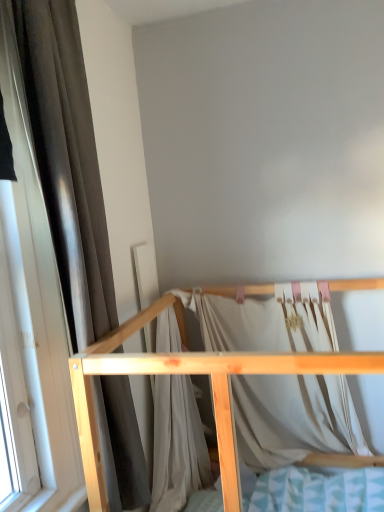
This screenshot has width=384, height=512. What are the coordinates of `brown fabric curtain at left` in the screenshot? It's located at (66, 160).

Describe the element at coordinates (66, 160) in the screenshot. Image resolution: width=384 pixels, height=512 pixels. I see `brown fabric curtain at left` at that location.

What do you see at coordinates (186, 373) in the screenshot? I see `natural wood bed frame at center` at bounding box center [186, 373].

What are the coordinates of `natural wood bed frame at center` in the screenshot? It's located at (186, 373).

The width and height of the screenshot is (384, 512). I want to click on brown fabric curtain at left, so click(x=66, y=160).

Which is more to the right, natural wood bed frame at center or brown fabric curtain at left?

natural wood bed frame at center.

Does natural wood bed frame at center lie in front of brown fabric curtain at left?

That is True.

Does point (163, 356) lie behind point (113, 305)?

No, it is in front of (113, 305).

From the image's perspective, which is above, natural wood bed frame at center or brown fabric curtain at left?

From the image's view, brown fabric curtain at left is above.

Looking at this image, from a real-world perspective, does natural wood bed frame at center sit lower than brown fabric curtain at left?

Yes, from a real-world perspective, natural wood bed frame at center is beneath brown fabric curtain at left.

Considering the sizes of objects natural wood bed frame at center and brown fabric curtain at left in the image provided, who is thinner, natural wood bed frame at center or brown fabric curtain at left?

brown fabric curtain at left.

Considering the relative sizes of natural wood bed frame at center and brown fabric curtain at left in the image provided, is natural wood bed frame at center shorter than brown fabric curtain at left?

Indeed, natural wood bed frame at center has a lesser height compared to brown fabric curtain at left.

Is natural wood bed frame at center bigger or smaller than brown fabric curtain at left?

natural wood bed frame at center is bigger than brown fabric curtain at left.

Is natural wood bed frame at center not within brown fabric curtain at left?

Yes, natural wood bed frame at center is located beyond the bounds of brown fabric curtain at left.

Are natural wood bed frame at center and brown fabric curtain at left far apart?

No, natural wood bed frame at center is not far away from brown fabric curtain at left.

Could you tell me if natural wood bed frame at center is facing brown fabric curtain at left?

No.

I want to click on curtain located above the natural wood bed frame at center (from the image's perspective), so click(66, 160).

Can you confirm if brown fabric curtain at left is positioned to the right of natural wood bed frame at center?

In fact, brown fabric curtain at left is to the left of natural wood bed frame at center.

Who is more distant, brown fabric curtain at left or natural wood bed frame at center?

brown fabric curtain at left is behind.

Which is in front, point (46, 133) or point (380, 464)?

Point (46, 133)

From the image's perspective, is brown fabric curtain at left located above or below natural wood bed frame at center?

Based on their image positions, brown fabric curtain at left is located above natural wood bed frame at center.

From a real-world perspective, is brown fabric curtain at left physically located above or below natural wood bed frame at center?

From a real-world perspective, brown fabric curtain at left is physically above natural wood bed frame at center.

Considering the sizes of objects brown fabric curtain at left and natural wood bed frame at center in the image provided, who is wider, brown fabric curtain at left or natural wood bed frame at center?

With larger width is natural wood bed frame at center.

Considering the sizes of objects brown fabric curtain at left and natural wood bed frame at center in the image provided, who is shorter, brown fabric curtain at left or natural wood bed frame at center?

With less height is natural wood bed frame at center.

Does brown fabric curtain at left have a smaller size compared to natural wood bed frame at center?

Yes.

Would you say natural wood bed frame at center is part of brown fabric curtain at left's contents?

No, natural wood bed frame at center is not inside brown fabric curtain at left.

Are brown fabric curtain at left and natural wood bed frame at center located far from each other?

That's not correct — brown fabric curtain at left is a little close to natural wood bed frame at center.

Is brown fabric curtain at left positioned with its back to natural wood bed frame at center?

No, brown fabric curtain at left's orientation is not away from natural wood bed frame at center.

What's the angular difference between brown fabric curtain at left and natural wood bed frame at center's facing directions?

87.8 degrees separate the facing orientations of brown fabric curtain at left and natural wood bed frame at center.

This screenshot has height=512, width=384. What are the coordinates of `curtain behind the natural wood bed frame at center` in the screenshot? It's located at (66, 160).

Locate an element on the screen. curtain behind the natural wood bed frame at center is located at coordinates (66, 160).

You are a GUI agent. You are given a task and a screenshot of the screen. Output one action in this format:
    pyautogui.click(x=<x>, y=<y>)
    Task: Click on the furniture on the right side of brown fabric curtain at left
    The image size is (384, 512).
    Given the screenshot: What is the action you would take?
    pyautogui.click(x=186, y=373)